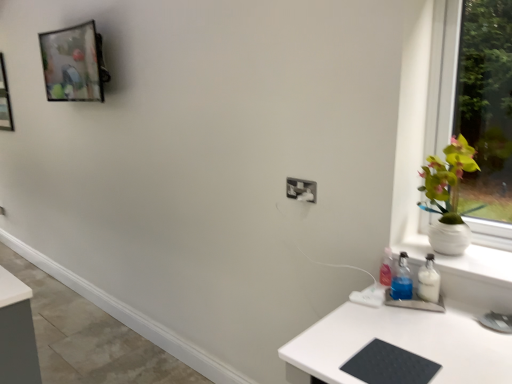
Question: From a real-world perspective, does white plastic electric outlet at center sit lower than metallic glass picture frame at upper left?

Choices:
 (A) no
 (B) yes

Answer: (B)

Question: Is white plastic electric outlet at center in contact with metallic glass picture frame at upper left?

Choices:
 (A) yes
 (B) no

Answer: (B)

Question: From the image's perspective, is white plastic electric outlet at center on metallic glass picture frame at upper left?

Choices:
 (A) no
 (B) yes

Answer: (A)

Question: Is white plastic electric outlet at center oriented away from metallic glass picture frame at upper left?

Choices:
 (A) yes
 (B) no

Answer: (B)

Question: Is white plastic electric outlet at center at the left side of metallic glass picture frame at upper left?

Choices:
 (A) yes
 (B) no

Answer: (B)

Question: In terms of size, does metallic glass picture frame at upper left appear bigger or smaller than white ceramic vase at right?

Choices:
 (A) big
 (B) small

Answer: (A)

Question: Considering the positions of point (76, 82) and point (456, 254), is point (76, 82) closer or farther from the camera than point (456, 254)?

Choices:
 (A) farther
 (B) closer

Answer: (A)

Question: Is metallic glass picture frame at upper left taller or shorter than white ceramic vase at right?

Choices:
 (A) short
 (B) tall

Answer: (B)

Question: From the image's perspective, is metallic glass picture frame at upper left positioned above or below white ceramic vase at right?

Choices:
 (A) above
 (B) below

Answer: (A)

Question: Considering the positions of white plastic electric outlet at center and metallic glass picture frame at upper left in the image, is white plastic electric outlet at center bigger or smaller than metallic glass picture frame at upper left?

Choices:
 (A) small
 (B) big

Answer: (A)

Question: Is white plastic electric outlet at center wider or thinner than metallic glass picture frame at upper left?

Choices:
 (A) thin
 (B) wide

Answer: (A)

Question: Considering the relative positions of white plastic electric outlet at center and metallic glass picture frame at upper left in the image provided, is white plastic electric outlet at center to the left or to the right of metallic glass picture frame at upper left?

Choices:
 (A) left
 (B) right

Answer: (B)

Question: In terms of height, does white plastic electric outlet at center look taller or shorter compared to metallic glass picture frame at upper left?

Choices:
 (A) tall
 (B) short

Answer: (B)

Question: From the image's perspective, is metallic glass picture frame at upper left located above or below white plastic electric outlet at center?

Choices:
 (A) below
 (B) above

Answer: (B)

Question: From a real-world perspective, is metallic glass picture frame at upper left above or below white plastic electric outlet at center?

Choices:
 (A) below
 (B) above

Answer: (B)